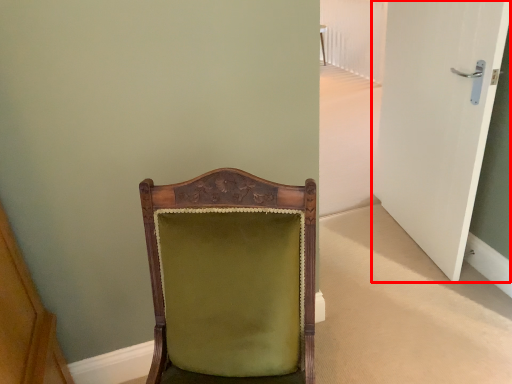
Question: In this image, where is door (annotated by the red box) located relative to chair?

Choices:
 (A) left
 (B) right

Answer: (B)